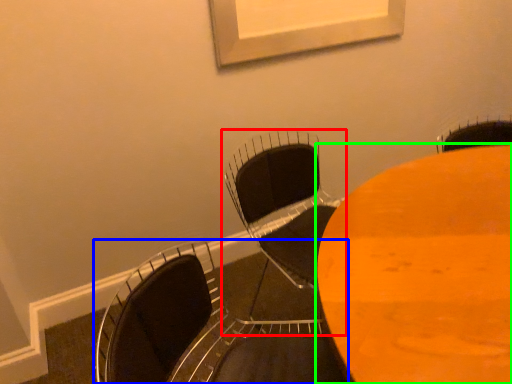
Question: Which object is positioned closest to chair (highlighted by a red box)? Select from chair (highlighted by a blue box) and table (highlighted by a green box).

Choices:
 (A) chair
 (B) table

Answer: (B)